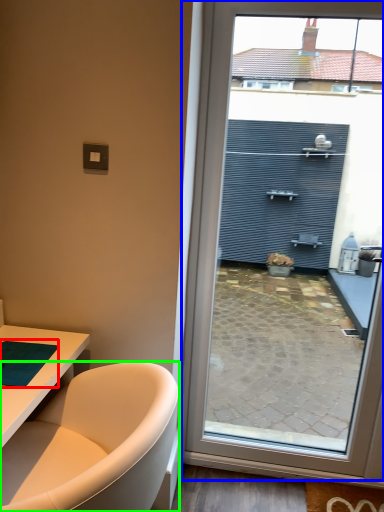
Question: Considering the real-world distances, which object is farthest from yoga mat (highlighted by a red box)? window (highlighted by a blue box) or bathtub (highlighted by a green box)?

Choices:
 (A) window
 (B) bathtub

Answer: (A)